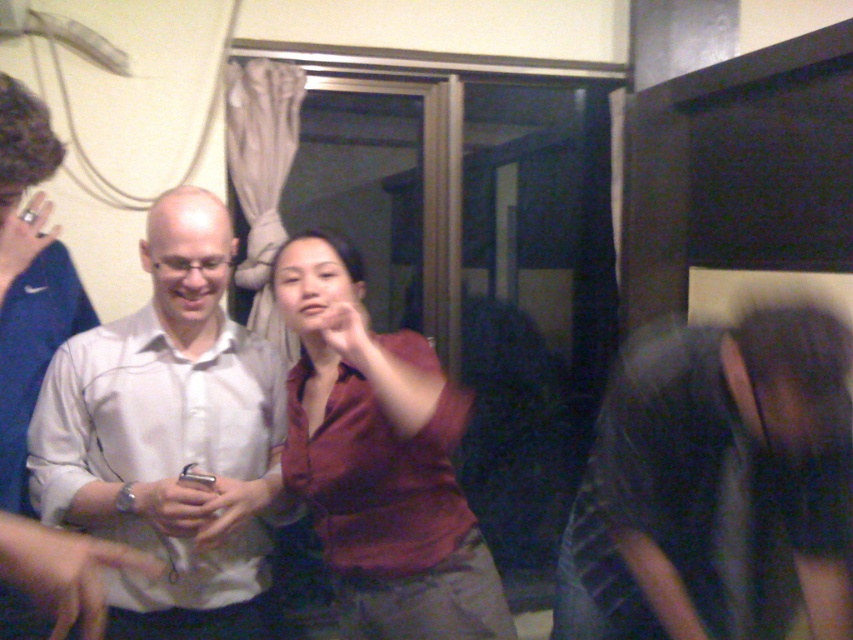
You are standing in the room and want to hand a gift to the person wearing the matte red shirt at center. However, there is an obstacle between you and them. Which direction should you move to avoid the dark blue jeans at lower right?

You should move to the left to avoid the dark blue jeans at lower right, as it is positioned to the right of the matte red shirt at center.

You are a photographer trying to capture a group photo of the people in the scene. The camera you are using has a focus range of 8 inches. Can you fit both the white matte shirt at center and the matte red shirt at center in the same frame without moving the camera?

The distance between the white matte shirt at center and the matte red shirt at center is 8.61 inches. Since the camera has a focus range of 8 inches, the distance between them exceeds the focus range. Therefore, you cannot fit both in the same frame without moving the camera.